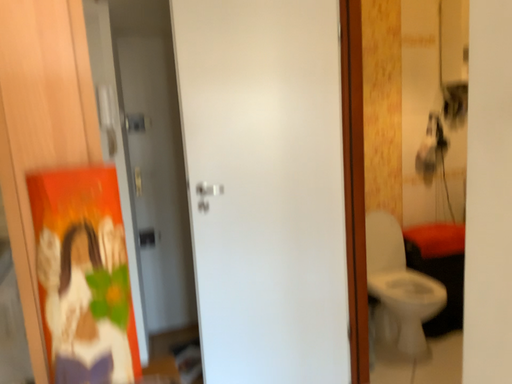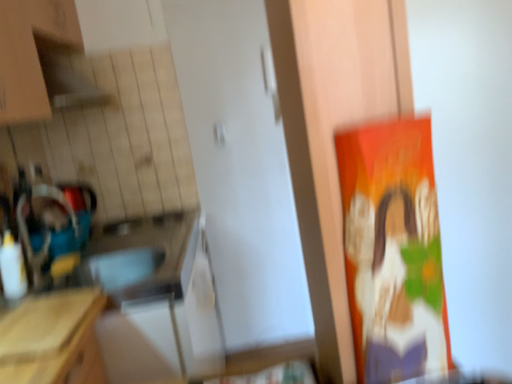
Question: How did the camera likely rotate when shooting the video?

Choices:
 (A) rotated left
 (B) rotated right

Answer: (A)